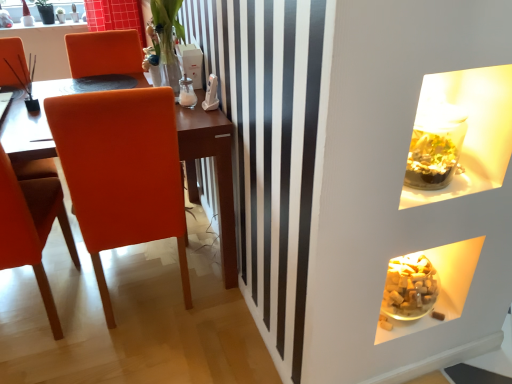
Question: Can you confirm if orange leather chair at left, arranged as the 1th chair when viewed from the right, is wider than translucent glass cubes at lower right, which appears as the 2th food when viewed from the right?

Choices:
 (A) yes
 (B) no

Answer: (A)

Question: Is orange leather chair at left, which is counted as the second chair, starting from the left, positioned far away from translucent glass cubes at lower right, which is the 1th food from left to right?

Choices:
 (A) no
 (B) yes

Answer: (A)

Question: From the image's perspective, is orange leather chair at left, arranged as the 1th chair when viewed from the right, on translucent glass cubes at lower right, which is the 1th food from left to right?

Choices:
 (A) yes
 (B) no

Answer: (A)

Question: From a real-world perspective, is orange leather chair at left, which is counted as the second chair, starting from the left, below translucent glass cubes at lower right, which is the 1th food from left to right?

Choices:
 (A) yes
 (B) no

Answer: (B)

Question: From the image's perspective, would you say orange leather chair at left, arranged as the 1th chair when viewed from the right, is shown under translucent glass cubes at lower right, which is the 1th food from left to right?

Choices:
 (A) yes
 (B) no

Answer: (B)

Question: In terms of size, does matte orange chair at left, which is the second chair in right-to-left order, appear bigger or smaller than translucent glass vase at upper center?

Choices:
 (A) small
 (B) big

Answer: (B)

Question: Is matte orange chair at left, which is the first chair from left to right, to the left or to the right of translucent glass vase at upper center in the image?

Choices:
 (A) right
 (B) left

Answer: (B)

Question: Would you say matte orange chair at left, which is the first chair from left to right, is inside or outside translucent glass vase at upper center?

Choices:
 (A) inside
 (B) outside

Answer: (B)

Question: Is point (54, 205) closer or farther from the camera than point (154, 46)?

Choices:
 (A) farther
 (B) closer

Answer: (B)

Question: From a real-world perspective, relative to translucent glass cubes at lower right, which appears as the 2th food when viewed from the right, is orange leather chair at left, which is counted as the second chair, starting from the left, vertically above or below?

Choices:
 (A) above
 (B) below

Answer: (A)

Question: Considering the positions of orange leather chair at left, which is counted as the second chair, starting from the left, and translucent glass cubes at lower right, which is the 1th food from left to right, in the image, is orange leather chair at left, which is counted as the second chair, starting from the left, bigger or smaller than translucent glass cubes at lower right, which is the 1th food from left to right,?

Choices:
 (A) big
 (B) small

Answer: (A)

Question: Looking at their shapes, would you say orange leather chair at left, which is counted as the second chair, starting from the left, is wider or thinner than translucent glass cubes at lower right, which is the 1th food from left to right?

Choices:
 (A) thin
 (B) wide

Answer: (B)

Question: From their relative heights in the image, would you say orange leather chair at left, which is counted as the second chair, starting from the left, is taller or shorter than translucent glass cubes at lower right, which is the 1th food from left to right?

Choices:
 (A) tall
 (B) short

Answer: (A)

Question: Is translucent glass cubes at lower right, which is the 1th food from left to right, wider or thinner than matte orange chair at left, which is the second chair in right-to-left order?

Choices:
 (A) wide
 (B) thin

Answer: (B)

Question: From the image's perspective, is translucent glass cubes at lower right, which is the 1th food from left to right, above or below matte orange chair at left, which is the second chair in right-to-left order?

Choices:
 (A) below
 (B) above

Answer: (A)